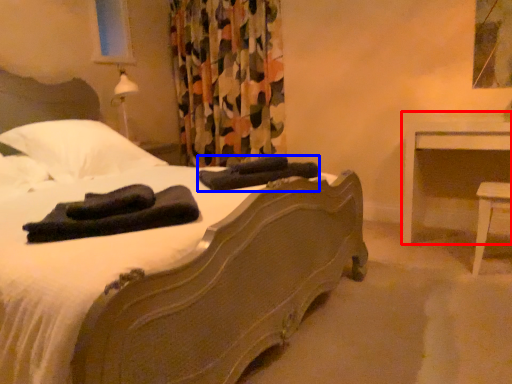
Question: Which of the following is the farthest to the observer, nightstand (highlighted by a red box) or material (highlighted by a blue box)?

Choices:
 (A) nightstand
 (B) material

Answer: (A)